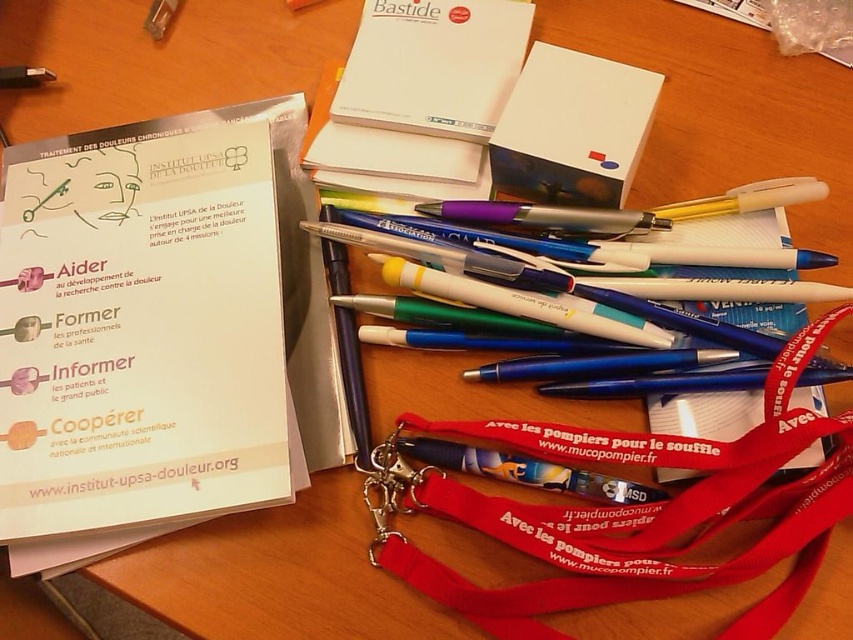
Which is above, red fabric lanyard at center or white paper notepad at upper center?

Positioned higher is white paper notepad at upper center.

Where is `red fabric lanyard at center`? The width and height of the screenshot is (853, 640). red fabric lanyard at center is located at coordinates (637, 513).

Locate an element on the screen. The width and height of the screenshot is (853, 640). red fabric lanyard at center is located at coordinates (637, 513).